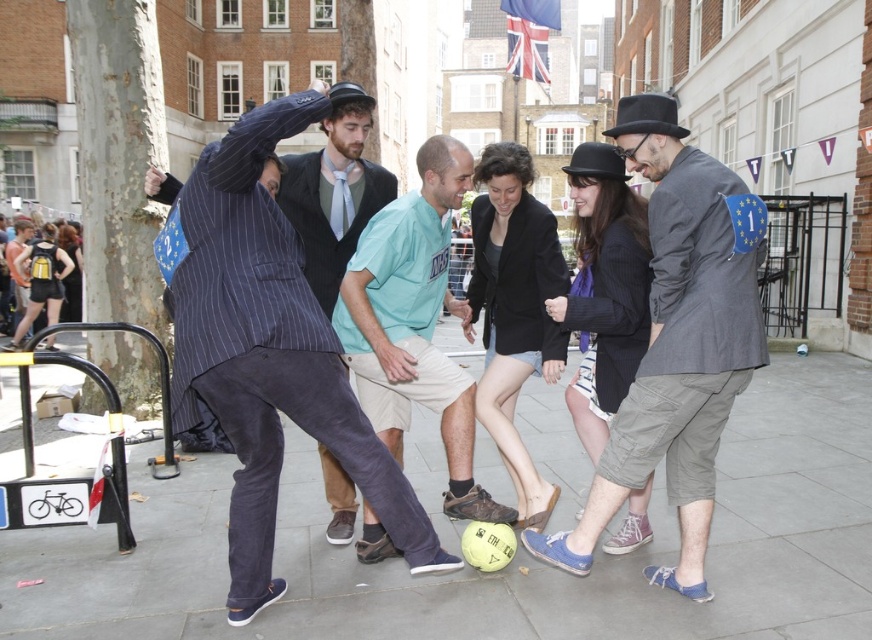
Does point (331, 412) come closer to viewer compared to point (467, 516)?

Yes, it is.

Which is in front, point (339, 362) or point (402, 388)?

Point (339, 362) is in front.

Does point (264, 129) come in front of point (385, 214)?

Yes, it is in front of point (385, 214).

This screenshot has height=640, width=872. I want to click on striped fabric suit at left, so click(269, 353).

Is the position of smooth concrete pavement at center less distant than that of striped fabric suit at left?

No, smooth concrete pavement at center is behind striped fabric suit at left.

Find the location of a particular element. This screenshot has width=872, height=640. smooth concrete pavement at center is located at coordinates (512, 561).

Locate an element on the screen. smooth concrete pavement at center is located at coordinates (512, 561).

Is point (823, 525) farther from viewer compared to point (618, 422)?

Yes, it is.

How much distance is there between smooth concrete pavement at center and gray cotton jacket at center?

They are 3.45 meters apart.

Is point (789, 576) farther from camera compared to point (706, 378)?

Yes, it is behind point (706, 378).

You are a GUI agent. You are given a task and a screenshot of the screen. Output one action in this format:
    pyautogui.click(x=<x>, y=<y>)
    Task: Click on the smooth concrete pavement at center
    The width and height of the screenshot is (872, 640).
    Given the screenshot: What is the action you would take?
    pyautogui.click(x=512, y=561)